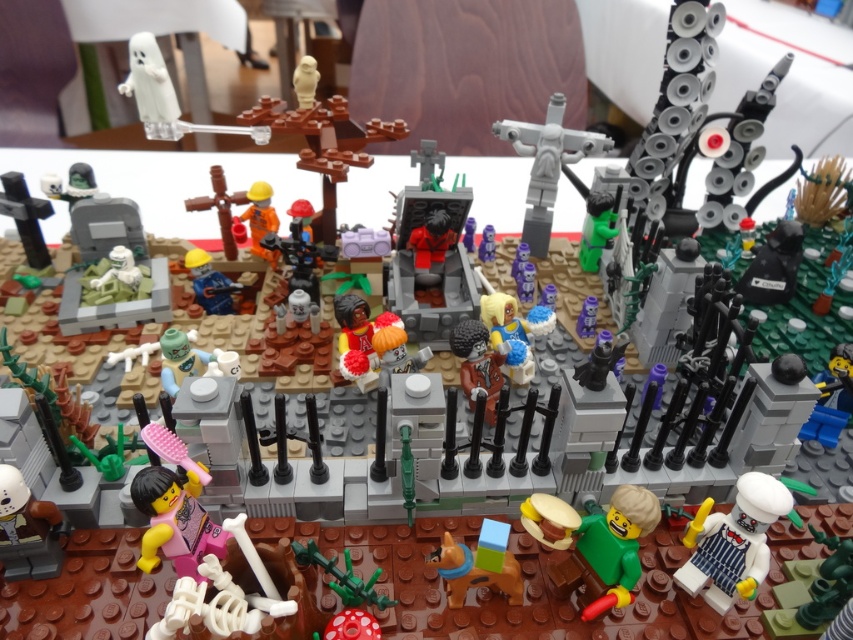
In the scene shown: You are a delivery robot with a height of 1.5 meters. You need to deliver a package to the blue plastic construction worker at center in the LEGO diorama. Can you reach the worker without bending down?

The blue plastic construction worker at center is 1.41 meters away from the viewer, so the robot can reach the worker without bending down since the robot is taller than the distance.

You are a child who wants to grab the white glossy chef hat at lower right from your current position. The maximum reach of your arm is 28 inches. Can you reach it without moving your feet?

The white glossy chef hat at lower right is 31.48 inches away from the viewer. Since your arm can only reach 28 inches, you cannot reach it without moving your feet.